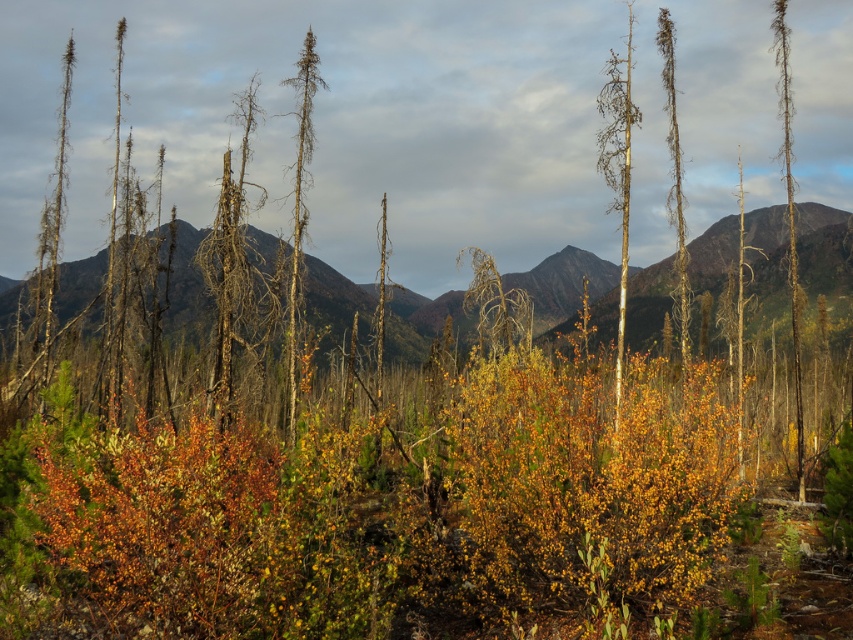
Question: Does dry wood tree at center appear on the right side of bare wood tree at center?

Choices:
 (A) no
 (B) yes

Answer: (A)

Question: Which point appears farthest from the camera in this image?

Choices:
 (A) (302, 134)
 (B) (798, 413)

Answer: (A)

Question: Among these points, which one is farthest from the camera?

Choices:
 (A) (218, 340)
 (B) (305, 51)

Answer: (B)

Question: Which point appears farthest from the camera in this image?

Choices:
 (A) (293, 369)
 (B) (415, 312)

Answer: (B)

Question: Is dry wood tree at center to the left of brown bark tree at right from the viewer's perspective?

Choices:
 (A) no
 (B) yes

Answer: (B)

Question: Can you confirm if bare wood tree at center is smaller than dead wood tree at left?

Choices:
 (A) yes
 (B) no

Answer: (B)